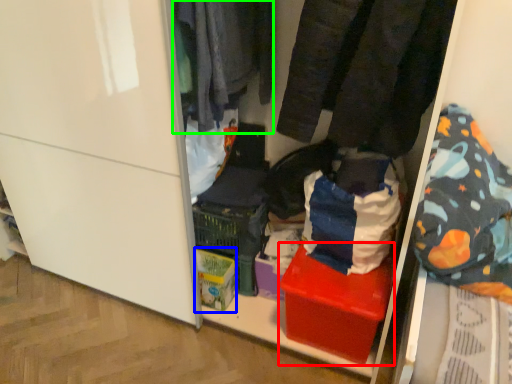
Question: Which object is positioned closest to box (highlighted by a red box)? Select from cardboard box (highlighted by a blue box) and clothing (highlighted by a green box).

Choices:
 (A) cardboard box
 (B) clothing

Answer: (A)